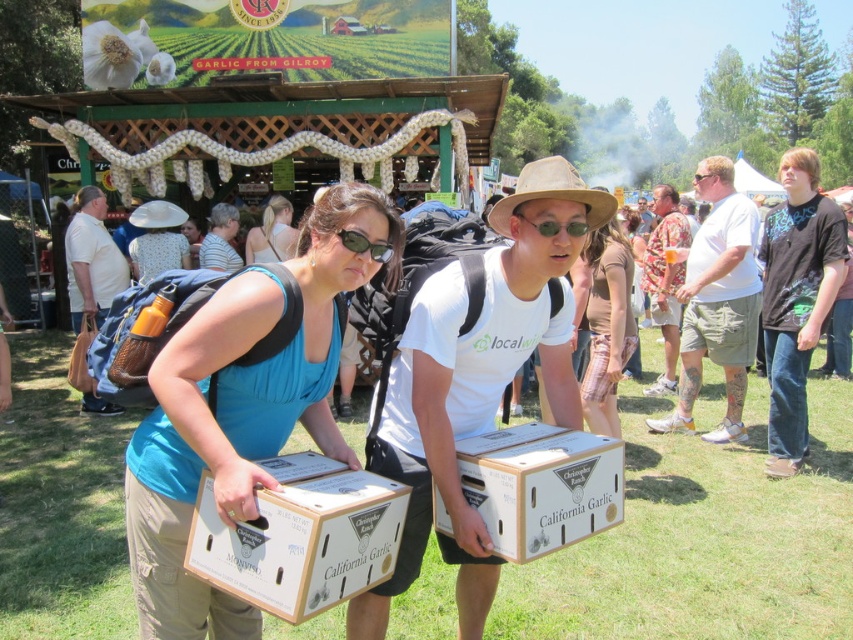
Can you confirm if wooden crate at center is taller than matte blue tank top at center?

No, wooden crate at center is not taller than matte blue tank top at center.

Which is more to the right, wooden crate at center or matte blue tank top at center?

From the viewer's perspective, wooden crate at center appears more on the right side.

Where is `wooden crate at center`? The image size is (853, 640). wooden crate at center is located at coordinates (300, 536).

This screenshot has height=640, width=853. Identify the location of wooden crate at center. (300, 536).

Is white cardboard box at center to the left of matte blue tank top at center from the viewer's perspective?

In fact, white cardboard box at center is to the right of matte blue tank top at center.

Is point (611, 449) positioned behind point (247, 252)?

No.

Between point (556, 504) and point (286, 240), which one is positioned in front?

Positioned in front is point (556, 504).

Identify the location of white cardboard box at center. The image size is (853, 640). (541, 486).

Who is taller, blue fabric tank top at center or matte blue tank top at center?

With more height is blue fabric tank top at center.

Can you confirm if blue fabric tank top at center is shorter than matte blue tank top at center?

No, blue fabric tank top at center is not shorter than matte blue tank top at center.

Which is in front, point (210, 636) or point (282, 220)?

Point (210, 636) is in front.

Find the location of `blue fabric tank top at center`. blue fabric tank top at center is located at coordinates (242, 406).